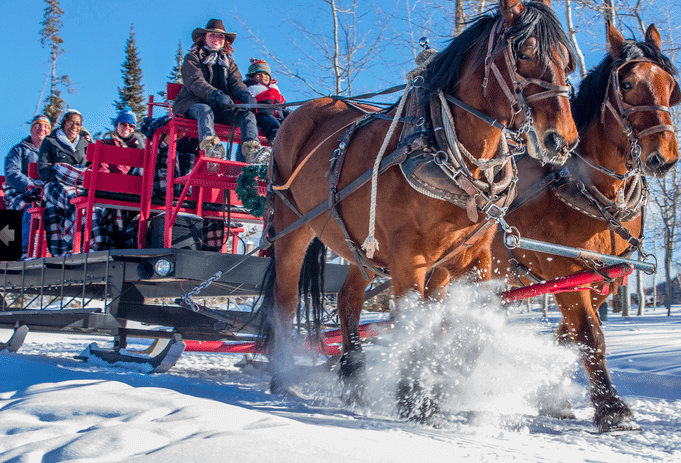
Where is `wreath`? wreath is located at coordinates (246, 194).